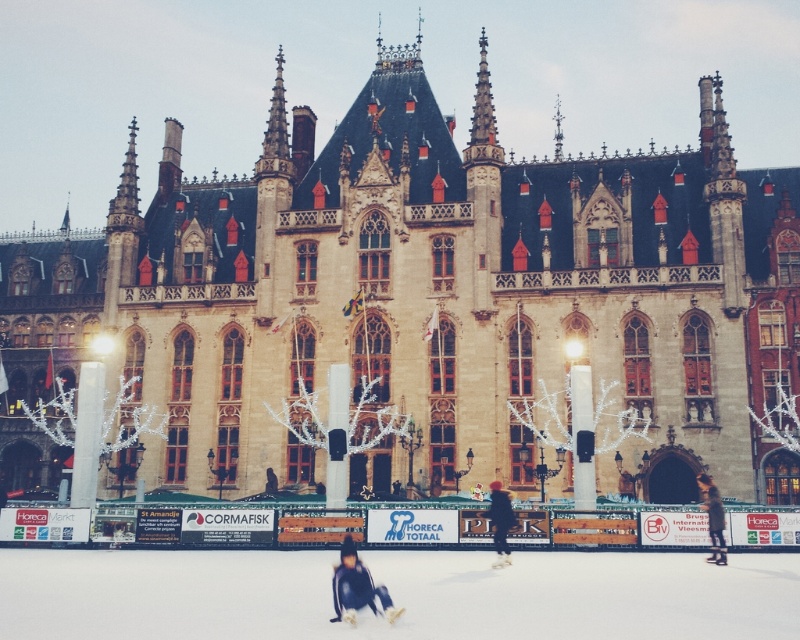
Between dark blue fabric at center and dark blue jacket at center, which one is positioned lower?

dark blue fabric at center is below.

Between point (350, 566) and point (492, 515), which one is positioned in front?

Point (350, 566) is in front.

Image resolution: width=800 pixels, height=640 pixels. Find the location of `dark blue fabric at center`. dark blue fabric at center is located at coordinates (356, 588).

I want to click on dark blue fabric at center, so click(x=356, y=588).

Is point (504, 525) behind point (716, 513)?

No, it is not.

Is dark blue jacket at center positioned behind dark brown leather jacket at lower right?

That is False.

The image size is (800, 640). What are the coordinates of `dark blue jacket at center` in the screenshot? It's located at (500, 522).

Identify the location of dark blue jacket at center. Image resolution: width=800 pixels, height=640 pixels. (500, 522).

Looking at this image, is dark blue fabric at center to the left of dark brown leather jacket at lower right from the viewer's perspective?

Indeed, dark blue fabric at center is positioned on the left side of dark brown leather jacket at lower right.

Who is more distant from viewer, (x=378, y=586) or (x=708, y=484)?

Positioned behind is point (x=708, y=484).

At what (x,y) coordinates should I click in order to perform the action: click on dark blue fabric at center. Please return your answer as a coordinate pair (x, y). Looking at the image, I should click on (356, 588).

Locate an element on the screen. This screenshot has height=640, width=800. dark blue fabric at center is located at coordinates (356, 588).